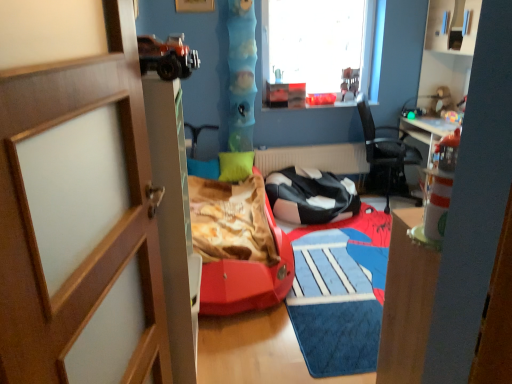
In order to click on black leather chair at center, which is the 1th chair in left-to-right order in this screenshot , I will do 311,196.

In the scene shown: Measure the distance between black leather chair at center, which is the 1th chair in left-to-right order, and camera.

They are 3.62 meters apart.

In order to face transparent glass window at upper center, should I rotate leftwards or rightwards?

It's best to rotate right around 8.391 degrees.

Describe the element at coordinates (321, 42) in the screenshot. I see `transparent glass window at upper center` at that location.

The height and width of the screenshot is (384, 512). What do you see at coordinates (234, 166) in the screenshot? I see `green matte pillow at center` at bounding box center [234, 166].

Where is `matte plastic toy at upper right, the 2th toy from the left`? The width and height of the screenshot is (512, 384). matte plastic toy at upper right, the 2th toy from the left is located at coordinates (440, 101).

This screenshot has height=384, width=512. I want to click on white matte radiator at center, so click(315, 158).

This screenshot has height=384, width=512. What do you see at coordinates (104, 236) in the screenshot? I see `wooden door at left` at bounding box center [104, 236].

This screenshot has width=512, height=384. What are the coordinates of `wooden door at left` in the screenshot? It's located at (104, 236).

In order to click on black leather chair at center, which is the 1th chair in left-to-right order in this screenshot , I will do `click(311, 196)`.

Can you confirm if matte plastic toy at upper right, placed as the first toy when sorted from right to left, is positioned to the right of black leather chair at center, the 2th chair when ordered from right to left?

Yes.

Does point (441, 97) lie in front of point (303, 205)?

That is False.

How different are the orientations of matte plastic toy at upper right, the 2th toy from the left, and black leather chair at center, the 2th chair when ordered from right to left, in degrees?

90.8 degrees.

Is smooth blue tube at center, the 2th toy positioned from the right, positioned far away from black mesh chair at center, acting as the 2th chair starting from the left?

Absolutely, smooth blue tube at center, the 2th toy positioned from the right, is distant from black mesh chair at center, acting as the 2th chair starting from the left.

Does smooth blue tube at center, arranged as the first toy when viewed from the left, have a lesser width compared to black mesh chair at center, acting as the 2th chair starting from the left?

Correct, the width of smooth blue tube at center, arranged as the first toy when viewed from the left, is less than that of black mesh chair at center, acting as the 2th chair starting from the left.

Is black mesh chair at center, acting as the 2th chair starting from the left, a part of smooth blue tube at center, arranged as the first toy when viewed from the left?

Definitely not — black mesh chair at center, acting as the 2th chair starting from the left, is not inside smooth blue tube at center, arranged as the first toy when viewed from the left.

At what (x,y) coordinates should I click in order to perform the action: click on window above the black leather chair at center, the 2th chair when ordered from right to left (from the image's perspective). Please return your answer as a coordinate pair (x, y). Looking at the image, I should click on (321, 42).

From the image's perspective, is black leather chair at center, the 2th chair when ordered from right to left, located above transparent glass window at upper center?

No, from the image's perspective, black leather chair at center, the 2th chair when ordered from right to left, is not above transparent glass window at upper center.

Considering the points (311, 197) and (318, 68), which point is in front, point (311, 197) or point (318, 68)?

The point (311, 197) is closer.

Does black leather chair at center, the 2th chair when ordered from right to left, have a smaller size compared to transparent glass window at upper center?

No.

Is matte plastic toy at upper right, placed as the first toy when sorted from right to left, far away from rubberized red car at center?

Yes, matte plastic toy at upper right, placed as the first toy when sorted from right to left, and rubberized red car at center are quite far apart.

Between matte plastic toy at upper right, placed as the first toy when sorted from right to left, and rubberized red car at center, which one has less height?

matte plastic toy at upper right, placed as the first toy when sorted from right to left.

Locate an element on the screen. Image resolution: width=512 pixels, height=384 pixels. toy that is the 1st object above the rubberized red car at center (from a real-world perspective) is located at coordinates (440, 101).

Is matte plastic toy at upper right, placed as the first toy when sorted from right to left, bigger than rubberized red car at center?

Actually, matte plastic toy at upper right, placed as the first toy when sorted from right to left, might be smaller than rubberized red car at center.

Would you say black mesh chair at center, acting as the 2th chair starting from the left, is outside green matte pillow at center?

black mesh chair at center, acting as the 2th chair starting from the left, lies outside green matte pillow at center's area.

Is the position of black mesh chair at center, acting as the 2th chair starting from the left, less distant than that of green matte pillow at center?

That is True.

Based on their sizes in the image, would you say black mesh chair at center, marked as the first chair in a right-to-left arrangement, is bigger or smaller than green matte pillow at center?

Considering their sizes, black mesh chair at center, marked as the first chair in a right-to-left arrangement, takes up more space than green matte pillow at center.

From the image's perspective, which object appears higher, black mesh chair at center, marked as the first chair in a right-to-left arrangement, or green matte pillow at center?

black mesh chair at center, marked as the first chair in a right-to-left arrangement, from the image's perspective.

Which is more to the left, smooth blue tube at center, the 2th toy positioned from the right, or rubberized red car at center?

smooth blue tube at center, the 2th toy positioned from the right, is more to the left.

Can we say smooth blue tube at center, the 2th toy positioned from the right, lies outside rubberized red car at center?

Indeed, smooth blue tube at center, the 2th toy positioned from the right, is completely outside rubberized red car at center.

From the image's perspective, is smooth blue tube at center, arranged as the first toy when viewed from the left, above or below rubberized red car at center?

smooth blue tube at center, arranged as the first toy when viewed from the left, is above rubberized red car at center.

Looking at the image, does smooth blue tube at center, the 2th toy positioned from the right, seem bigger or smaller compared to rubberized red car at center?

Considering their sizes, smooth blue tube at center, the 2th toy positioned from the right, takes up less space than rubberized red car at center.

Does white matte radiator at center have a larger size compared to matte plastic toy at upper right, the 2th toy from the left?

Yes.

Who is more distant, white matte radiator at center or matte plastic toy at upper right, the 2th toy from the left?

white matte radiator at center.

Looking at this image, does white matte radiator at center have a lesser height compared to matte plastic toy at upper right, placed as the first toy when sorted from right to left?

No, white matte radiator at center is not shorter than matte plastic toy at upper right, placed as the first toy when sorted from right to left.

Find the location of a particular element. chair that is the 2nd one below the matte plastic toy at upper right, the 2th toy from the left (from a real-world perspective) is located at coordinates (311, 196).

Where is `the 1st chair positioned below the smooth blue tube at center, the 2th toy positioned from the right (from the image's perspective)`? the 1st chair positioned below the smooth blue tube at center, the 2th toy positioned from the right (from the image's perspective) is located at coordinates (388, 154).

When comparing their distances from black leather chair at center, which is the 1th chair in left-to-right order, does transparent glass window at upper center or green matte pillow at center seem further?

Based on the image, transparent glass window at upper center appears to be further to black leather chair at center, which is the 1th chair in left-to-right order.

When comparing their distances from smooth blue tube at center, the 2th toy positioned from the right, does wooden door at left or transparent glass window at upper center seem closer?

The object closer to smooth blue tube at center, the 2th toy positioned from the right, is transparent glass window at upper center.

Based on their spatial positions, is black leather chair at center, which is the 1th chair in left-to-right order, or green matte pillow at center further from matte plastic toy at upper right, the 2th toy from the left?

green matte pillow at center is positioned further to the anchor matte plastic toy at upper right, the 2th toy from the left.

From the image, which object appears to be farther from green matte pillow at center, matte plastic toy at upper right, placed as the first toy when sorted from right to left, or smooth blue tube at center, arranged as the first toy when viewed from the left?

matte plastic toy at upper right, placed as the first toy when sorted from right to left, is further to green matte pillow at center.

When comparing their distances from smooth blue tube at center, arranged as the first toy when viewed from the left, does wooden door at left or matte plastic toy at upper right, the 2th toy from the left, seem closer?

Among the two, matte plastic toy at upper right, the 2th toy from the left, is located nearer to smooth blue tube at center, arranged as the first toy when viewed from the left.

Based on their spatial positions, is smooth blue tube at center, the 2th toy positioned from the right, or rubberized red car at center closer to white matte radiator at center?

The object closer to white matte radiator at center is smooth blue tube at center, the 2th toy positioned from the right.

Considering their positions, is white matte radiator at center positioned closer to smooth blue tube at center, arranged as the first toy when viewed from the left, than transparent glass window at upper center?

white matte radiator at center is closer to smooth blue tube at center, arranged as the first toy when viewed from the left.

Based on their spatial positions, is black mesh chair at center, marked as the first chair in a right-to-left arrangement, or wooden door at left further from black leather chair at center, which is the 1th chair in left-to-right order?

The object further to black leather chair at center, which is the 1th chair in left-to-right order, is wooden door at left.

You are a GUI agent. You are given a task and a screenshot of the screen. Output one action in this format:
    pyautogui.click(x=<x>, y=<y>)
    Task: Click on the radiator between green matte pillow at center and black mesh chair at center, marked as the first chair in a right-to-left arrangement, from left to right
    
    Given the screenshot: What is the action you would take?
    pyautogui.click(x=315, y=158)

Where is `radiator between smooth blue tube at center, arranged as the first toy when viewed from the left, and black mesh chair at center, marked as the first chair in a right-to-left arrangement`? This screenshot has height=384, width=512. radiator between smooth blue tube at center, arranged as the first toy when viewed from the left, and black mesh chair at center, marked as the first chair in a right-to-left arrangement is located at coordinates (315, 158).

The image size is (512, 384). Identify the location of radiator located between smooth blue tube at center, the 2th toy positioned from the right, and matte plastic toy at upper right, placed as the first toy when sorted from right to left, in the left-right direction. (315, 158).

Identify the location of bed frame between smooth blue tube at center, the 2th toy positioned from the right, and matte plastic toy at upper right, placed as the first toy when sorted from right to left, from left to right. (248, 279).